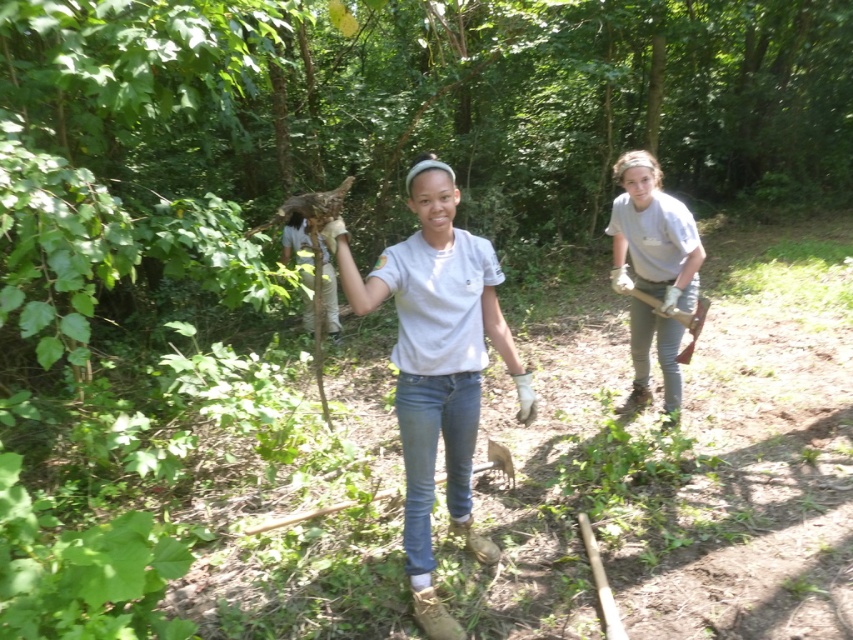
Question: Which of the following is the farthest from the observer?

Choices:
 (A) wooden shovel at right
 (B) white cotton shirt at center

Answer: (A)

Question: Which object is the closest to the white cotton shirt at center?

Choices:
 (A) gray matte shirt at right
 (B) wooden shovel at right

Answer: (A)

Question: In this image, where is white cotton shirt at center located relative to gray matte shirt at right?

Choices:
 (A) below
 (B) above

Answer: (A)

Question: Which point is closer to the camera taking this photo?

Choices:
 (A) (635, 317)
 (B) (450, 186)
 (C) (654, 310)

Answer: (B)

Question: Is white cotton shirt at center smaller than wooden shovel at right?

Choices:
 (A) yes
 (B) no

Answer: (B)

Question: From the image, what is the correct spatial relationship of white cotton shirt at center in relation to gray matte shirt at right?

Choices:
 (A) left
 (B) right

Answer: (A)